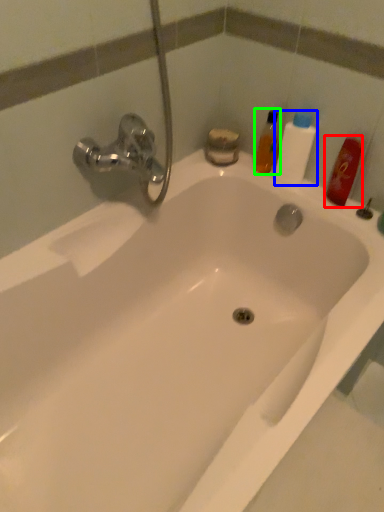
Question: Estimate the real-world distances between objects in this image. Which object is farther from mouthwash (highlighted by a red box), cleaning product (highlighted by a blue box) or mouthwash (highlighted by a green box)?

Choices:
 (A) cleaning product
 (B) mouthwash

Answer: (B)